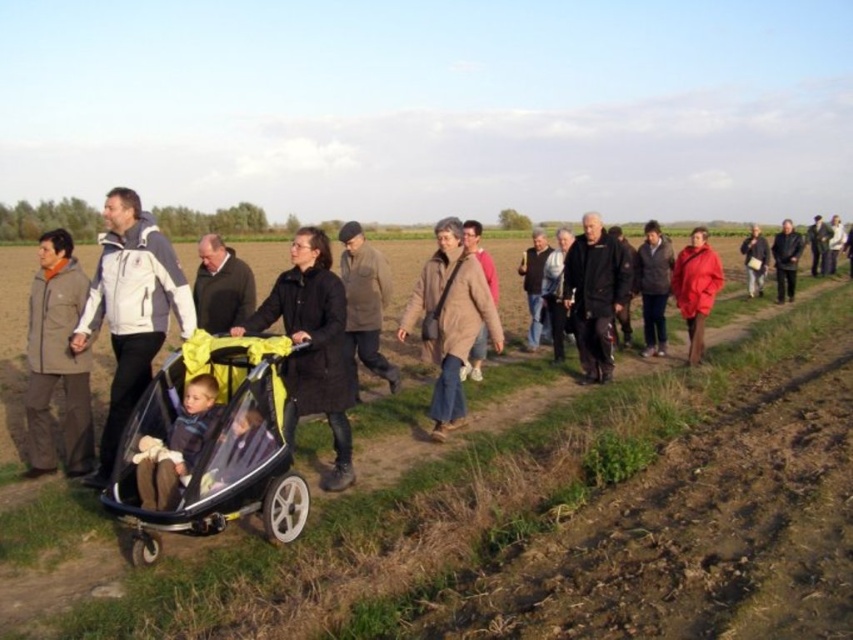
You are standing at the point marked by the coordinate point (12, 346). Looking around, what object is located exactly at your current position?

The point (12, 346) marks the yellow fabric stroller at center.

You are a photographer trying to capture a candid shot of the group without being noticed. You notice the transparent plastic baby carriage at center and the black matte coat at center. Which object should you focus on to ensure the subject is closer to the camera?

The transparent plastic baby carriage at center is positioned on the right side of black matte coat at center, so focusing on the transparent plastic baby carriage at center would place it closer to the camera since it is to the right of the coat.

You are a photographer trying to capture a photo of the transparent plastic baby carriage at center and the black matte coat at center. To ensure both are in focus, you need to know which object is taller. Can you tell me which one is taller?

The transparent plastic baby carriage at center is taller than the black matte coat at center, so you should adjust your camera settings to accommodate the height difference for proper focus.